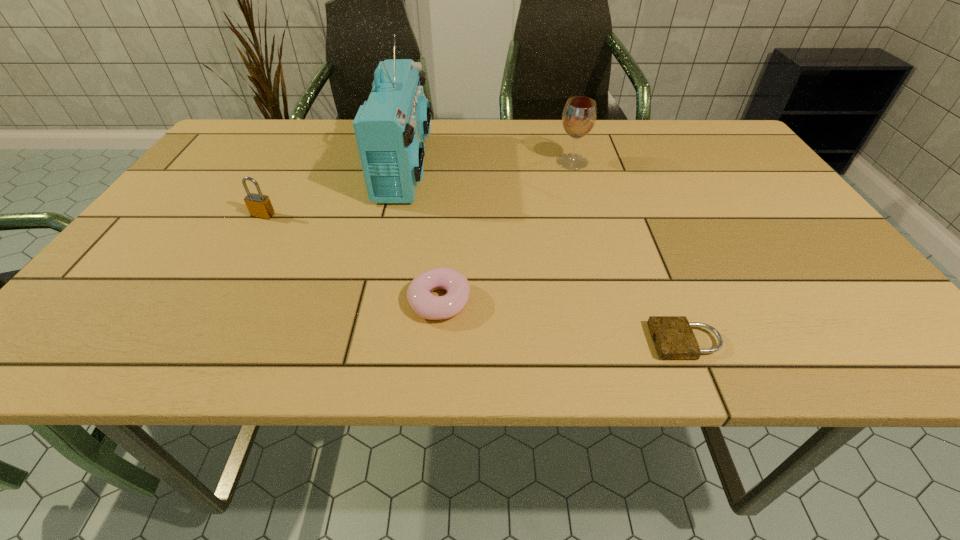
Image resolution: width=960 pixels, height=540 pixels. I want to click on free spot located 0.280m on the front of the farther padlock, so click(205, 315).

Identify the location of free spot located 0.110m on the right of the fourth tallest object. This screenshot has width=960, height=540. (530, 301).

The width and height of the screenshot is (960, 540). In order to click on blank space located on the keyhole side of the shorter padlock in this screenshot , I will do `click(624, 341)`.

The image size is (960, 540). Identify the location of vacant space located on the keyhole side of the shorter padlock. (507, 341).

This screenshot has width=960, height=540. What are the coordinates of `free space located 0.190m on the keyhole side of the shorter padlock` in the screenshot? It's located at (541, 341).

At what (x,y) coordinates should I click in order to perform the action: click on radio receiver present at the far edge. Please return your answer as a coordinate pair (x, y). The image size is (960, 540). Looking at the image, I should click on (391, 127).

Locate an element on the screen. The width and height of the screenshot is (960, 540). wineglass that is positioned at the far edge is located at coordinates (579, 115).

This screenshot has width=960, height=540. I want to click on doughnut present at the near edge, so click(424, 304).

Where is `padlock located at the near edge`? The width and height of the screenshot is (960, 540). padlock located at the near edge is located at coordinates (673, 338).

In the image, there is a desktop. Find the location of `free space at the far edge`. free space at the far edge is located at coordinates (434, 124).